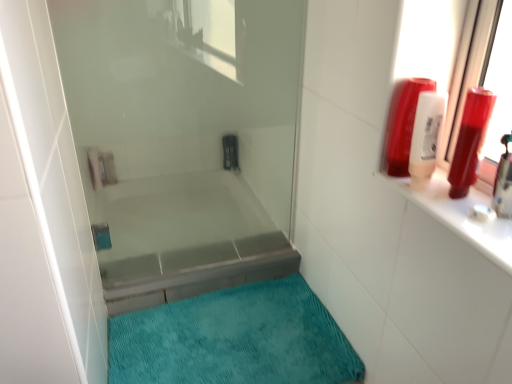
Question: From the image's perspective, is translucent plastic shampoo bottle at upper right, placed as the 2th toiletry when sorted from right to left, beneath shiny plastic bottle at upper right, placed as the 3th toiletry when sorted from left to right?

Choices:
 (A) no
 (B) yes

Answer: (A)

Question: Could you tell me if translucent plastic shampoo bottle at upper right, placed as the 2th toiletry when sorted from right to left, is turned towards shiny plastic bottle at upper right, the 1th toiletry from the right?

Choices:
 (A) yes
 (B) no

Answer: (B)

Question: Considering the relative sizes of translucent plastic shampoo bottle at upper right, arranged as the 2th toiletry when viewed from the left, and shiny plastic bottle at upper right, placed as the 3th toiletry when sorted from left to right, in the image provided, is translucent plastic shampoo bottle at upper right, arranged as the 2th toiletry when viewed from the left, bigger than shiny plastic bottle at upper right, placed as the 3th toiletry when sorted from left to right,?

Choices:
 (A) yes
 (B) no

Answer: (A)

Question: Does translucent plastic shampoo bottle at upper right, placed as the 2th toiletry when sorted from right to left, have a greater height compared to shiny plastic bottle at upper right, the 1th toiletry from the right?

Choices:
 (A) yes
 (B) no

Answer: (B)

Question: Does translucent plastic shampoo bottle at upper right, arranged as the 2th toiletry when viewed from the left, have a greater width compared to shiny plastic bottle at upper right, the 1th toiletry from the right?

Choices:
 (A) no
 (B) yes

Answer: (B)

Question: From the image's perspective, does translucent plastic shampoo bottle at upper right, placed as the 2th toiletry when sorted from right to left, appear higher than shiny plastic bottle at upper right, placed as the 3th toiletry when sorted from left to right?

Choices:
 (A) yes
 (B) no

Answer: (A)

Question: Does teal plush bath mat at lower center have a lesser height compared to matte plastic shampoo bottle at upper right, positioned as the 3th toiletry in right-to-left order?

Choices:
 (A) no
 (B) yes

Answer: (B)

Question: Considering the relative positions of teal plush bath mat at lower center and matte plastic shampoo bottle at upper right, which is counted as the first toiletry, starting from the left, in the image provided, is teal plush bath mat at lower center behind matte plastic shampoo bottle at upper right, which is counted as the first toiletry, starting from the left,?

Choices:
 (A) no
 (B) yes

Answer: (B)

Question: From a real-world perspective, does teal plush bath mat at lower center sit lower than matte plastic shampoo bottle at upper right, which is counted as the first toiletry, starting from the left?

Choices:
 (A) no
 (B) yes

Answer: (B)

Question: From a real-world perspective, does teal plush bath mat at lower center stand above matte plastic shampoo bottle at upper right, which is counted as the first toiletry, starting from the left?

Choices:
 (A) yes
 (B) no

Answer: (B)

Question: Is teal plush bath mat at lower center looking in the opposite direction of matte plastic shampoo bottle at upper right, which is counted as the first toiletry, starting from the left?

Choices:
 (A) no
 (B) yes

Answer: (A)

Question: Considering the relative sizes of teal plush bath mat at lower center and matte plastic shampoo bottle at upper right, which is counted as the first toiletry, starting from the left, in the image provided, is teal plush bath mat at lower center taller than matte plastic shampoo bottle at upper right, which is counted as the first toiletry, starting from the left,?

Choices:
 (A) no
 (B) yes

Answer: (A)

Question: Considering the relative sizes of matte plastic shampoo bottle at upper right, positioned as the 3th toiletry in right-to-left order, and transparent glass shower door at center in the image provided, is matte plastic shampoo bottle at upper right, positioned as the 3th toiletry in right-to-left order, shorter than transparent glass shower door at center?

Choices:
 (A) yes
 (B) no

Answer: (A)